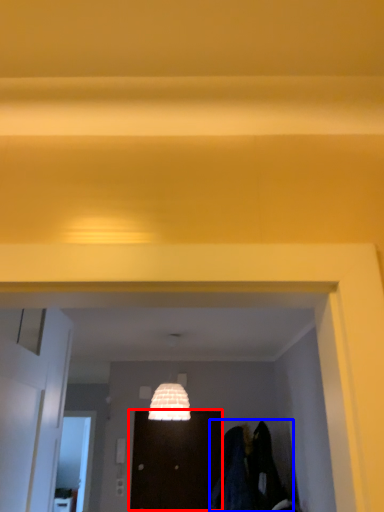
Question: Among these objects, which one is farthest to the camera, door (highlighted by a red box) or laundry (highlighted by a blue box)?

Choices:
 (A) door
 (B) laundry

Answer: (A)